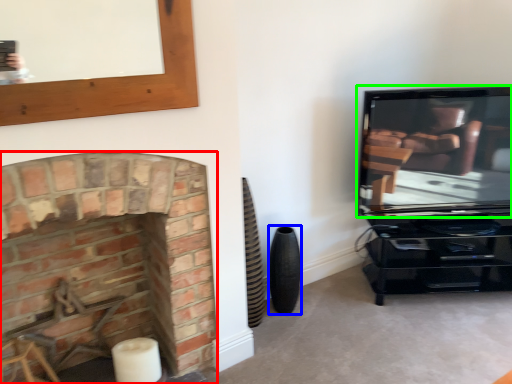
Question: Which object is positioned closest to fireplace (highlighted by a red box)? Select from speaker (highlighted by a blue box) and television (highlighted by a green box).

Choices:
 (A) speaker
 (B) television

Answer: (A)